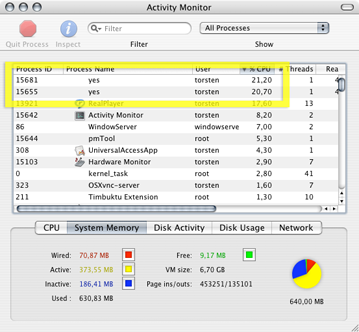
Where is `columns`? columns is located at coordinates (47, 79), (124, 82), (232, 79), (276, 82), (297, 79), (328, 79).